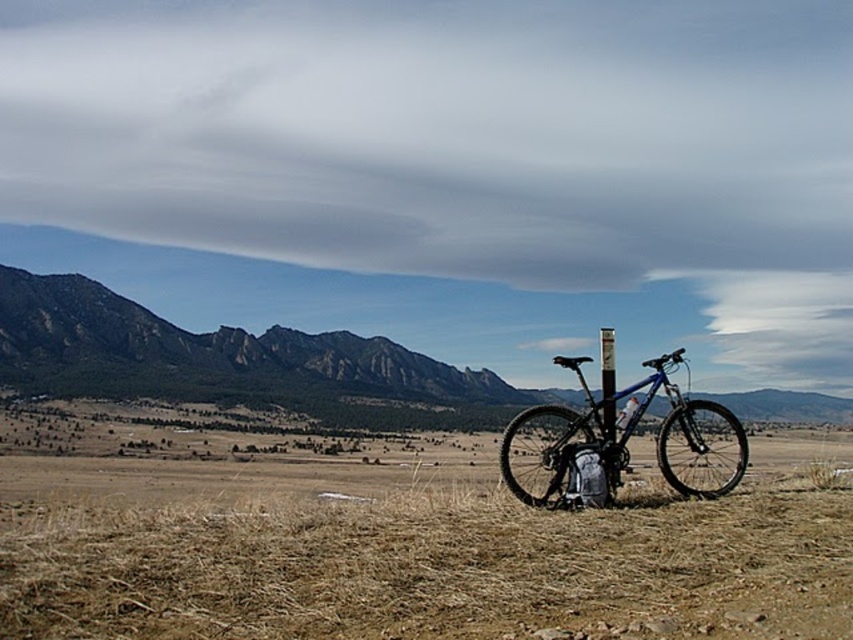
Who is positioned more to the left, rugged brown mountain at left or blue matte bicycle at center?

From the viewer's perspective, rugged brown mountain at left appears more on the left side.

Which is in front, point (96, 332) or point (660, 378)?

Point (660, 378)

Where is `rugged brown mountain at left`? The height and width of the screenshot is (640, 853). rugged brown mountain at left is located at coordinates (212, 348).